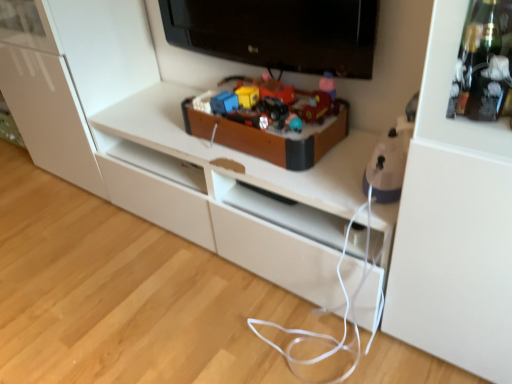
Question: Should I look upward or downward to see purple plastic iron at right, which is the 2th toy in back-to-front order?

Choices:
 (A) up
 (B) down

Answer: (A)

Question: Are black glossy television at upper center and purple plastic iron at right, placed as the 2th toy when sorted from left to right, far apart?

Choices:
 (A) no
 (B) yes

Answer: (A)

Question: From the image's perspective, is black glossy television at upper center located beneath purple plastic iron at right, placed as the 2th toy when sorted from left to right?

Choices:
 (A) no
 (B) yes

Answer: (A)

Question: Is black glossy television at upper center taller than purple plastic iron at right, which is the 2th toy in back-to-front order?

Choices:
 (A) yes
 (B) no

Answer: (A)

Question: Could you tell me if black glossy television at upper center is facing purple plastic iron at right, placed as the 2th toy when sorted from left to right?

Choices:
 (A) no
 (B) yes

Answer: (A)

Question: Is black glossy television at upper center thinner than purple plastic iron at right, positioned as the 1th toy in front-to-back order?

Choices:
 (A) no
 (B) yes

Answer: (B)

Question: Is black glossy television at upper center shorter than purple plastic iron at right, which is the first toy from right to left?

Choices:
 (A) yes
 (B) no

Answer: (B)

Question: Does wooden toy box at center, which appears as the 2th toy when viewed from the right, have a smaller size compared to purple plastic iron at right, positioned as the 1th toy in front-to-back order?

Choices:
 (A) yes
 (B) no

Answer: (B)

Question: Is wooden toy box at center, the 1th toy positioned from the left, looking in the opposite direction of purple plastic iron at right, which is the 2th toy in back-to-front order?

Choices:
 (A) no
 (B) yes

Answer: (B)

Question: Can you confirm if wooden toy box at center, positioned as the 1th toy in back-to-front order, is bigger than purple plastic iron at right, which is the first toy from right to left?

Choices:
 (A) yes
 (B) no

Answer: (A)

Question: Is wooden toy box at center, the 1th toy positioned from the left, to the right of purple plastic iron at right, positioned as the 1th toy in front-to-back order, from the viewer's perspective?

Choices:
 (A) no
 (B) yes

Answer: (A)

Question: From a real-world perspective, is wooden toy box at center, which is the second toy in front-to-back order, located beneath purple plastic iron at right, which is the first toy from right to left?

Choices:
 (A) yes
 (B) no

Answer: (A)

Question: Is wooden toy box at center, which is the second toy in front-to-back order, to the left of purple plastic iron at right, which is the first toy from right to left, from the viewer's perspective?

Choices:
 (A) no
 (B) yes

Answer: (B)

Question: From the image's perspective, is black glossy television at upper center on top of wooden toy box at center, which appears as the 2th toy when viewed from the right?

Choices:
 (A) no
 (B) yes

Answer: (B)